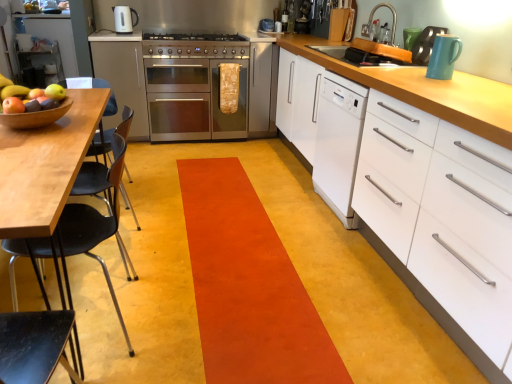
Locate an element on the screen. The image size is (512, 384). empty space that is ontop of orange carpet at center is located at coordinates (239, 248).